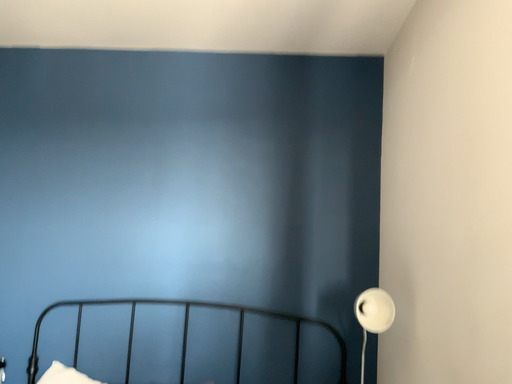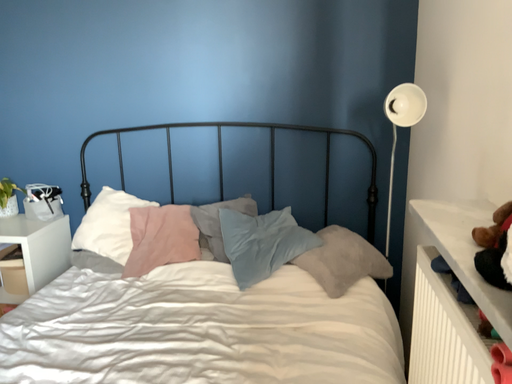
Question: Which way did the camera rotate in the video?

Choices:
 (A) rotated upward
 (B) rotated downward

Answer: (B)